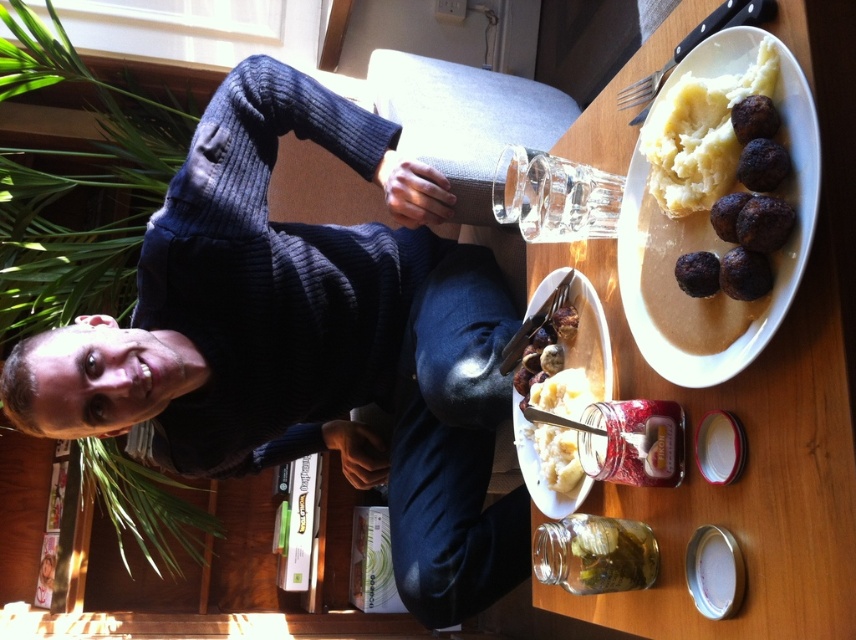
This screenshot has width=856, height=640. What do you see at coordinates (758, 408) in the screenshot? I see `white ceramic plate at upper center` at bounding box center [758, 408].

Who is taller, white ceramic plate at upper center or brown matte meatballs at upper right?

With more height is white ceramic plate at upper center.

This screenshot has width=856, height=640. Identify the location of white ceramic plate at upper center. (758, 408).

Which is below, white ceramic plate at upper center or white matte mashed potatoes at center?

white matte mashed potatoes at center

How distant is white ceramic plate at upper center from white matte mashed potatoes at center?

They are 13.69 centimeters apart.

Between point (830, 406) and point (518, 403), which one is positioned behind?

The point (518, 403) is more distant.

The image size is (856, 640). I want to click on white ceramic plate at upper center, so click(758, 408).

Is dark blue ribbed sweater at upper center smaller than white creamy mashed potato at center?

Actually, dark blue ribbed sweater at upper center might be larger than white creamy mashed potato at center.

What do you see at coordinates (306, 340) in the screenshot? The height and width of the screenshot is (640, 856). I see `dark blue ribbed sweater at upper center` at bounding box center [306, 340].

Locate an element on the screen. dark blue ribbed sweater at upper center is located at coordinates (306, 340).